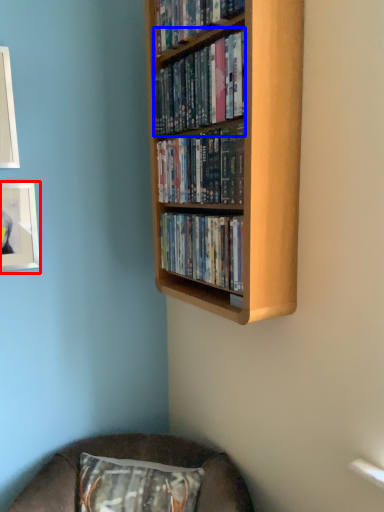
Question: Among these objects, which one is farthest to the camera, picture frame (highlighted by a red box) or book (highlighted by a blue box)?

Choices:
 (A) picture frame
 (B) book

Answer: (A)